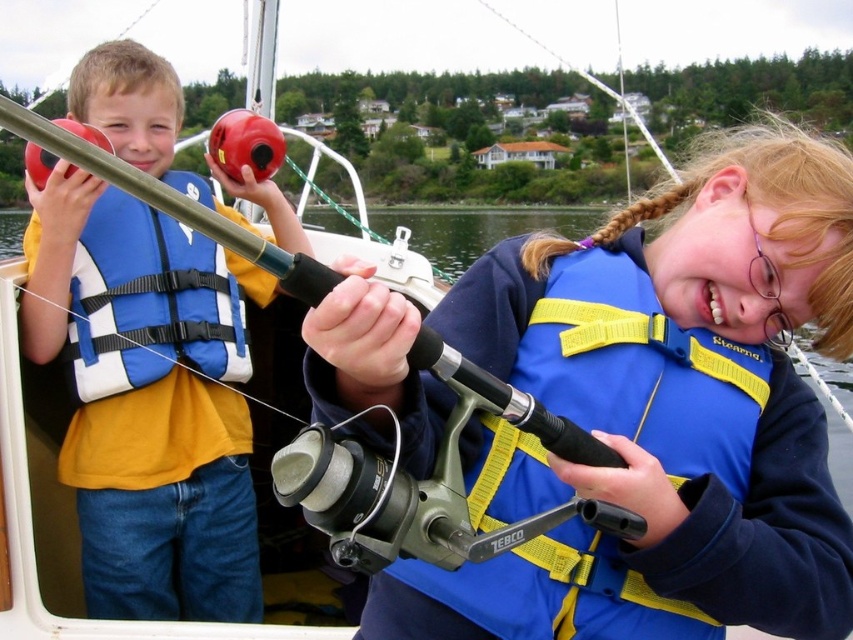
Question: Is matte plastic fishing rod at left smaller than blue/yellow fabric life vest at center?

Choices:
 (A) no
 (B) yes

Answer: (A)

Question: Which point is closer to the camera taking this photo?

Choices:
 (A) (170, 120)
 (B) (693, 627)

Answer: (B)

Question: Is matte plastic fishing rod at left closer to camera compared to blue/yellow fabric life vest at center?

Choices:
 (A) yes
 (B) no

Answer: (B)

Question: Is matte plastic fishing rod at left smaller than blue/yellow fabric life vest at center?

Choices:
 (A) no
 (B) yes

Answer: (A)

Question: Among these objects, which one is farthest from the camera?

Choices:
 (A) blue/yellow fabric life vest at center
 (B) matte plastic fishing rod at left

Answer: (B)